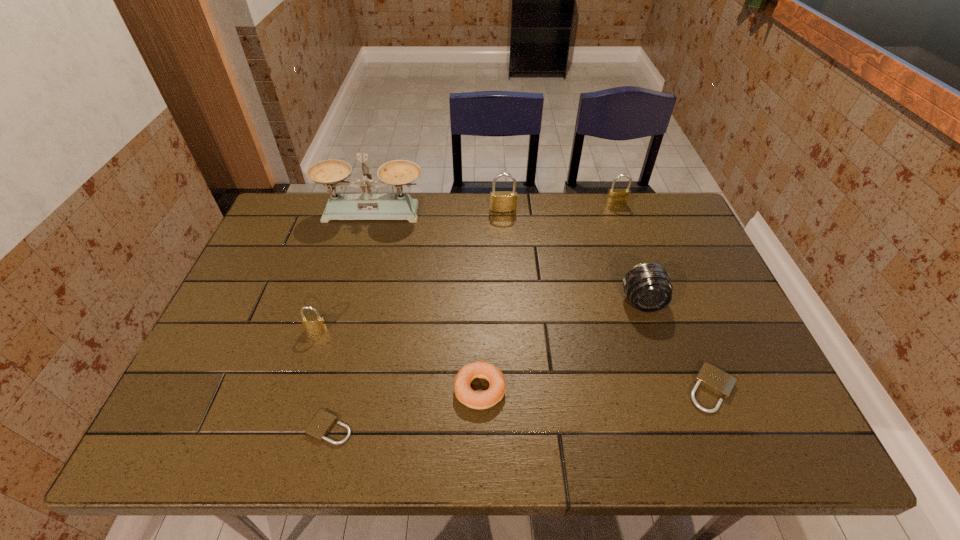
You are a GUI agent. You are given a task and a screenshot of the screen. Output one action in this format:
    pyautogui.click(x=<x>, y=<y>)
    Task: Click on the scale
    This screenshot has height=540, width=960.
    Given the screenshot: What is the action you would take?
    pyautogui.click(x=331, y=173)

Image resolution: width=960 pixels, height=540 pixels. I want to click on the second tallest object, so click(x=501, y=202).

Locate an element on the screen. The width and height of the screenshot is (960, 540). the biggest brass padlock is located at coordinates (501, 202).

The height and width of the screenshot is (540, 960). Find the location of `the second tallest padlock`. the second tallest padlock is located at coordinates (617, 197).

The image size is (960, 540). In order to click on the farthest brass padlock in this screenshot , I will do `click(617, 197)`.

Locate an element on the screen. The width and height of the screenshot is (960, 540). telephoto lens is located at coordinates (648, 287).

Find the location of a particular element. Image resolution: width=960 pixels, height=540 pixels. the nearest brass padlock is located at coordinates (310, 323).

This screenshot has height=540, width=960. What are the coordinates of `the third farthest padlock` in the screenshot? It's located at (310, 323).

Where is `tan bagel`? The image size is (960, 540). tan bagel is located at coordinates (465, 394).

The image size is (960, 540). I want to click on bagel, so click(x=465, y=394).